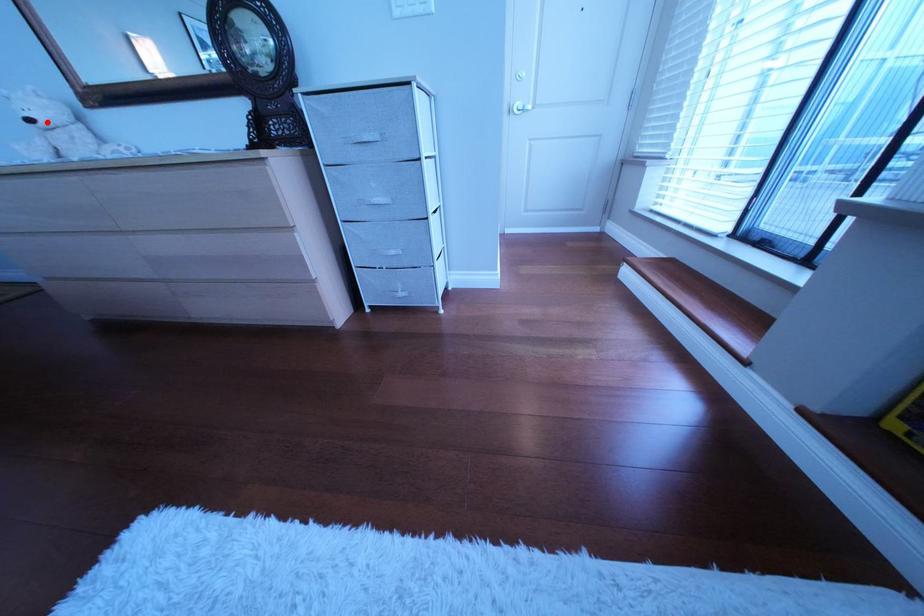
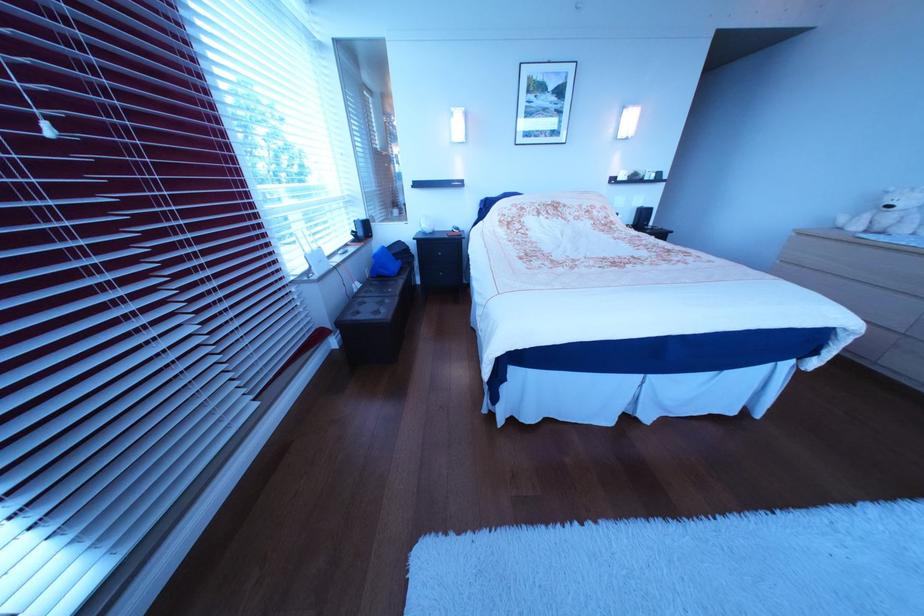
The point at the highlighted location is marked in the first image. Where is the corresponding point in the second image?

(906, 209)